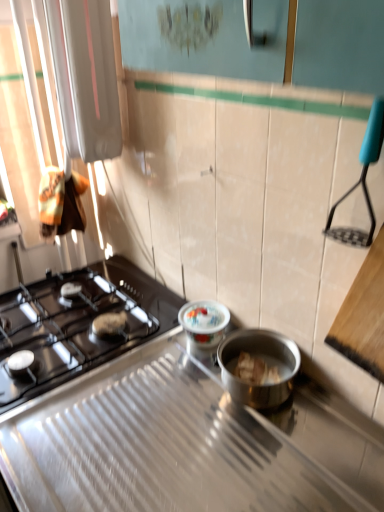
Question: Is porcelain floral-patterned container at center facing away from black glass gas stove at left, placed as the 1th gas stove when sorted from back to front?

Choices:
 (A) yes
 (B) no

Answer: (B)

Question: Is black glass gas stove at left, the second gas stove from the front, a part of porcelain floral-patterned container at center?

Choices:
 (A) no
 (B) yes

Answer: (A)

Question: Is porcelain floral-patterned container at center aimed at black glass gas stove at left, the second gas stove from the front?

Choices:
 (A) no
 (B) yes

Answer: (A)

Question: From the image's perspective, does porcelain floral-patterned container at center appear lower than black glass gas stove at left, placed as the 1th gas stove when sorted from back to front?

Choices:
 (A) no
 (B) yes

Answer: (A)

Question: Considering the relative sizes of porcelain floral-patterned container at center and black glass gas stove at left, placed as the 1th gas stove when sorted from back to front, in the image provided, is porcelain floral-patterned container at center shorter than black glass gas stove at left, placed as the 1th gas stove when sorted from back to front,?

Choices:
 (A) yes
 (B) no

Answer: (A)

Question: Is black matte gas stove at left, which is the second gas stove from back to front, inside or outside of black glass gas stove at left, placed as the 1th gas stove when sorted from back to front?

Choices:
 (A) inside
 (B) outside

Answer: (B)

Question: Would you say black matte gas stove at left, which is the second gas stove from back to front, is to the left or to the right of black glass gas stove at left, placed as the 1th gas stove when sorted from back to front, in the picture?

Choices:
 (A) left
 (B) right

Answer: (B)

Question: From the image's perspective, is black matte gas stove at left, which is the second gas stove from back to front, located above or below black glass gas stove at left, placed as the 1th gas stove when sorted from back to front?

Choices:
 (A) below
 (B) above

Answer: (A)

Question: Considering their positions, is black matte gas stove at left, which is the second gas stove from back to front, located in front of or behind black glass gas stove at left, the second gas stove from the front?

Choices:
 (A) front
 (B) behind

Answer: (A)

Question: In terms of height, does black matte gas stove at left, which is the second gas stove from back to front, look taller or shorter compared to porcelain floral-patterned container at center?

Choices:
 (A) tall
 (B) short

Answer: (B)

Question: From a real-world perspective, is black matte gas stove at left, which is counted as the 1th gas stove, starting from the front, positioned above or below porcelain floral-patterned container at center?

Choices:
 (A) above
 (B) below

Answer: (B)

Question: Based on their sizes in the image, would you say black matte gas stove at left, which is the second gas stove from back to front, is bigger or smaller than porcelain floral-patterned container at center?

Choices:
 (A) small
 (B) big

Answer: (B)

Question: Is point (211, 437) positioned closer to the camera than point (215, 328)?

Choices:
 (A) farther
 (B) closer

Answer: (B)

Question: Is porcelain floral-patterned container at center inside the boundaries of black glass gas stove at left, the second gas stove from the front, or outside?

Choices:
 (A) outside
 (B) inside

Answer: (A)

Question: In the image, is porcelain floral-patterned container at center on the left side or the right side of black glass gas stove at left, the second gas stove from the front?

Choices:
 (A) left
 (B) right

Answer: (B)